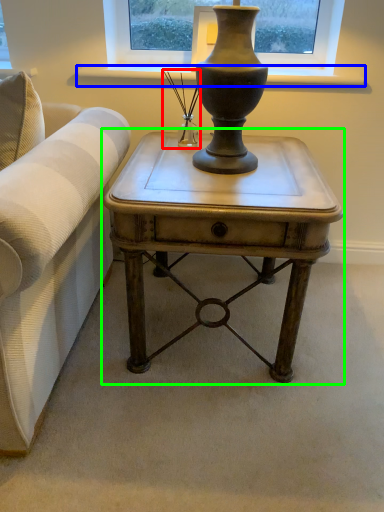
Question: Based on their relative distances, which object is nearer to candle holder (highlighted by a red box)? Choose from window sill (highlighted by a blue box) and table (highlighted by a green box).

Choices:
 (A) window sill
 (B) table

Answer: (A)